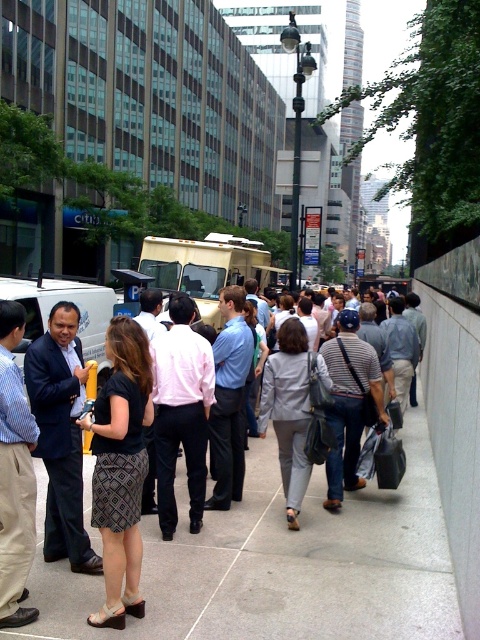
Question: Which is nearer to the gray fabric jacket at center?

Choices:
 (A) gray concrete sidewalk at center
 (B) dark blue suit at center
 (C) beige plastic food truck at center
 (D) patterned fabric skirt at center

Answer: (A)

Question: Considering the relative positions of gray fabric jacket at center and beige plastic food truck at center in the image provided, where is gray fabric jacket at center located with respect to beige plastic food truck at center?

Choices:
 (A) left
 (B) right

Answer: (B)

Question: Which of the following is the closest to the observer?

Choices:
 (A) (302, 497)
 (B) (260, 586)

Answer: (B)

Question: Considering the relative positions of patterned fabric skirt at center and pink shirt at center in the image provided, where is patterned fabric skirt at center located with respect to pink shirt at center?

Choices:
 (A) below
 (B) above

Answer: (A)

Question: Which object is farther from the camera taking this photo?

Choices:
 (A) pink shirt at center
 (B) gray concrete sidewalk at center
 (C) dark blue suit at center

Answer: (A)

Question: Can you confirm if patterned fabric skirt at center is bigger than pink shirt at center?

Choices:
 (A) yes
 (B) no

Answer: (B)